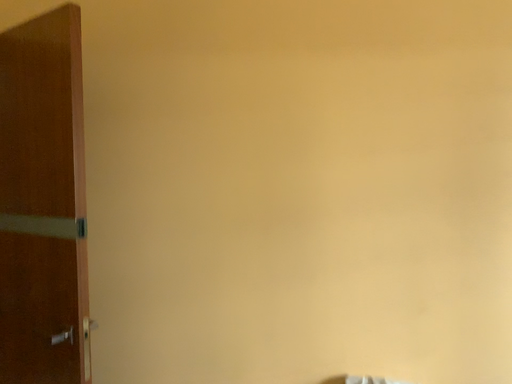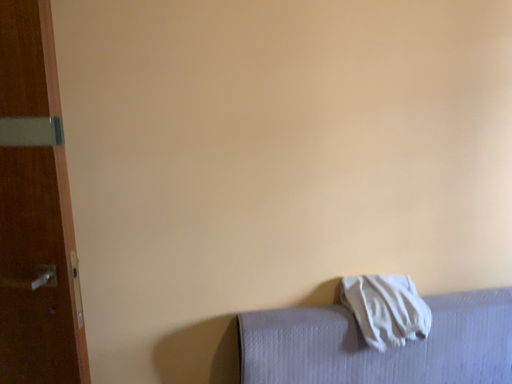
Question: Which way did the camera rotate in the video?

Choices:
 (A) rotated right
 (B) rotated left

Answer: (A)